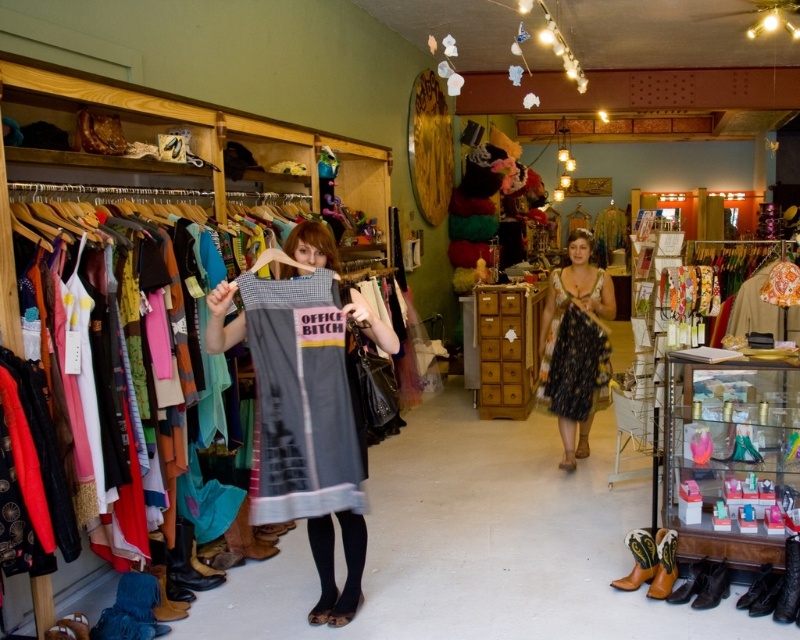
You are a customer in the vintage clothing store and want to know which dress is taller between the gray cotton dress at center and the matte black dress at center. Can you tell me?

The gray cotton dress at center is much taller than the matte black dress at center.